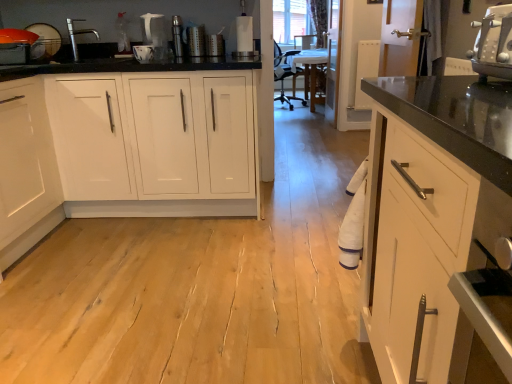
The height and width of the screenshot is (384, 512). I want to click on free location in front of white glossy cabinet at left, so click(151, 288).